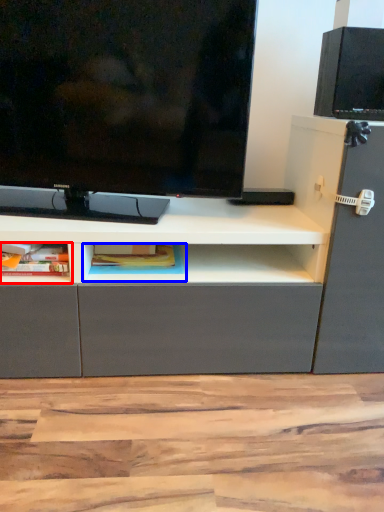
Question: Which object appears farthest to the camera in this image, cabinet (highlighted by a red box) or cabinet (highlighted by a blue box)?

Choices:
 (A) cabinet
 (B) cabinet

Answer: (B)